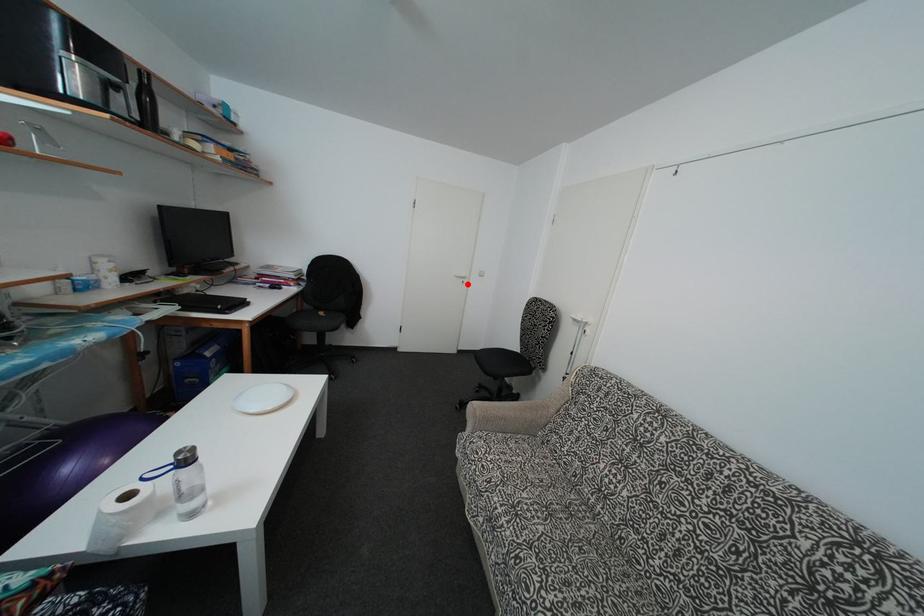
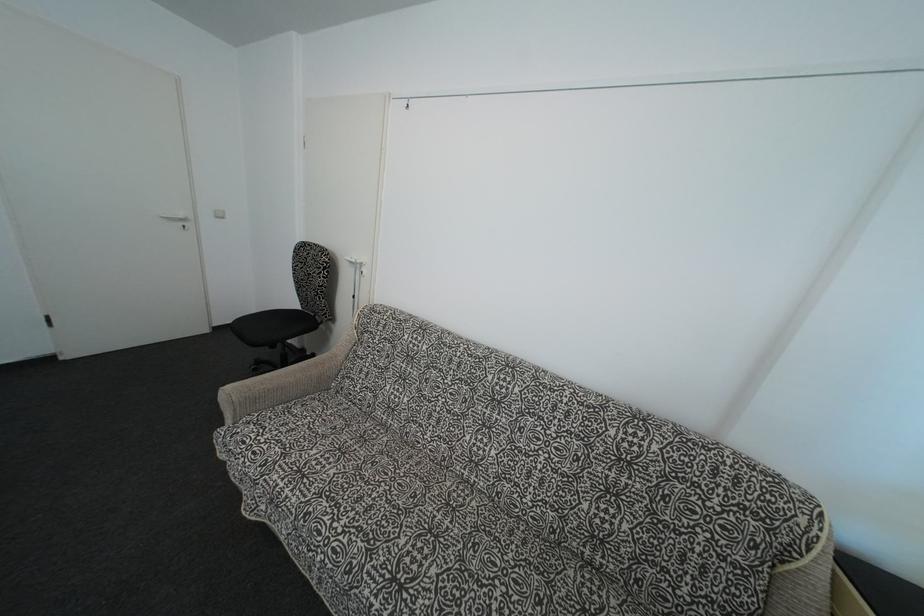
Find the pixel in the second image that matches the highlighted location in the first image.

(188, 227)